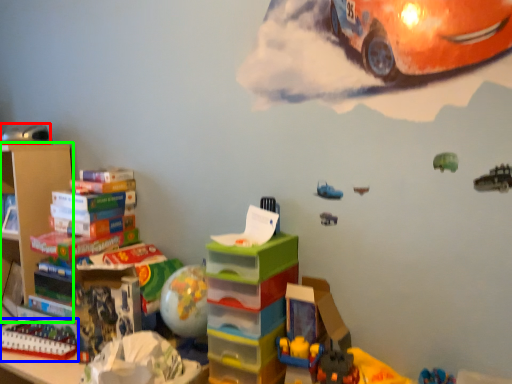
Question: Which is farther away from toy (highlighted by a red box)? toy (highlighted by a blue box) or shelf (highlighted by a green box)?

Choices:
 (A) toy
 (B) shelf

Answer: (A)